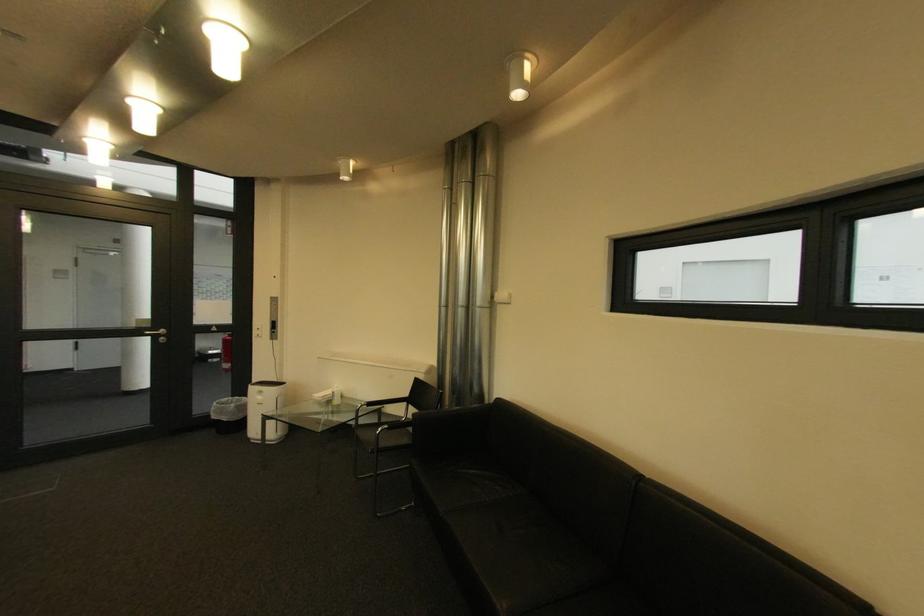
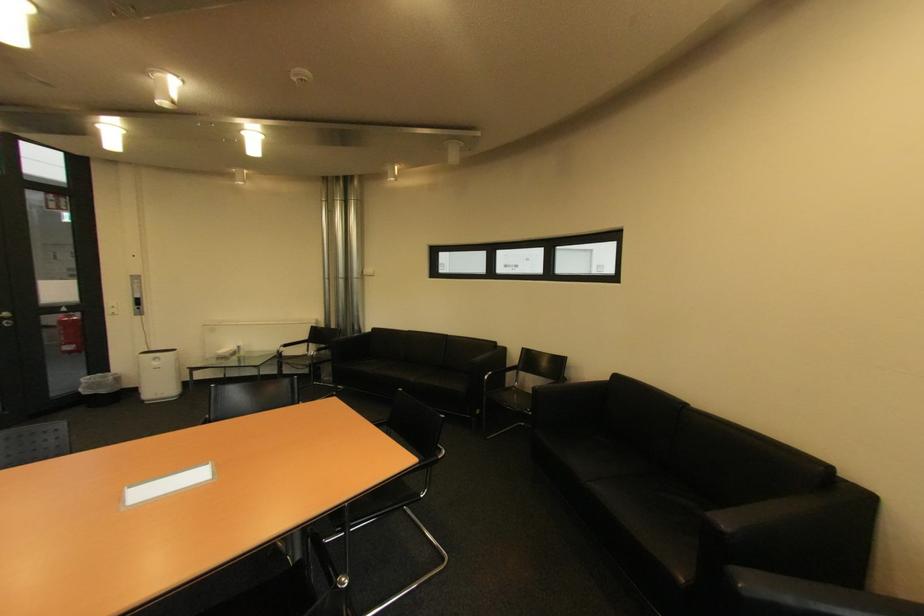
The point at [268,399] is marked in the first image. Where is the corresponding point in the second image?

(164, 363)